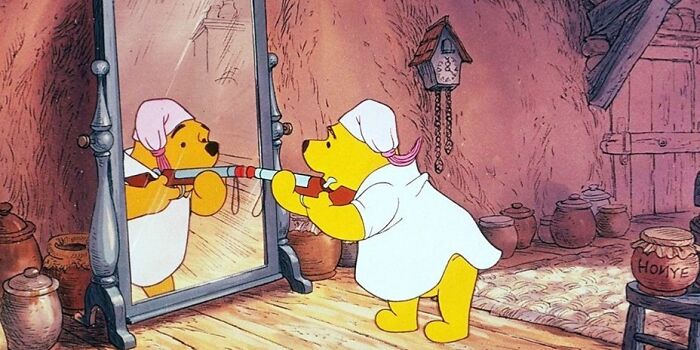
Where is `lids with knobs`? lids with knobs is located at coordinates (12, 221), (33, 283), (519, 202), (577, 199), (594, 197).